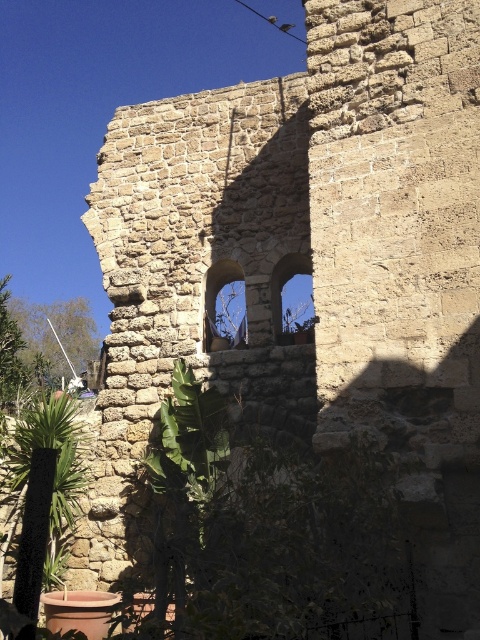
Does green leafy plant at lower left lie behind stone window at center?

No, it is in front of stone window at center.

Is green leafy plant at lower left bigger than stone window at center?

Indeed, green leafy plant at lower left has a larger size compared to stone window at center.

Find the location of a particular element. This screenshot has width=480, height=640. green leafy plant at lower left is located at coordinates (55, 465).

Is stone window at center positioned behind transparent glass window at upper center?

Yes, stone window at center is further from the viewer.

Between point (220, 264) and point (307, 273), which one is positioned behind?

Point (307, 273)

This screenshot has height=640, width=480. Identify the location of stone window at center. (216, 291).

Does green leafy plant at lower left appear over transparent glass window at upper center?

Actually, green leafy plant at lower left is below transparent glass window at upper center.

Does point (16, 520) come farther from viewer compared to point (275, 268)?

That is False.

What do you see at coordinates (55, 465) in the screenshot?
I see `green leafy plant at lower left` at bounding box center [55, 465].

The width and height of the screenshot is (480, 640). Find the location of `green leafy plant at lower left`. green leafy plant at lower left is located at coordinates (55, 465).